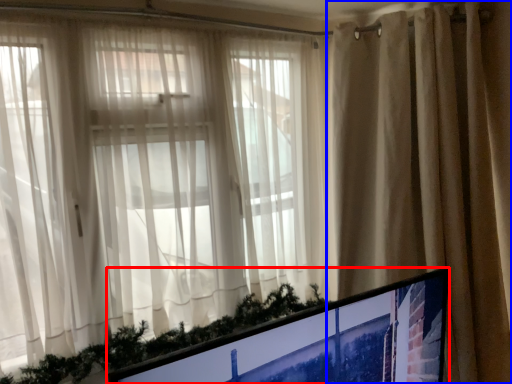
Question: Among these objects, which one is nearest to the camera, computer monitor (highlighted by a red box) or curtain (highlighted by a blue box)?

Choices:
 (A) computer monitor
 (B) curtain

Answer: (A)